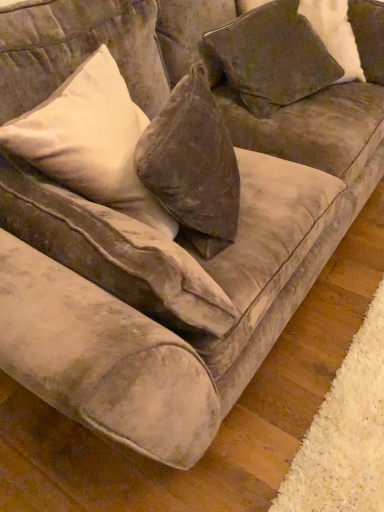
Image resolution: width=384 pixels, height=512 pixels. Find the location of `velvet beige pillow at upper left, acting as the first pillow starting from the left`. velvet beige pillow at upper left, acting as the first pillow starting from the left is located at coordinates (90, 141).

What do you see at coordinates (90, 141) in the screenshot?
I see `velvet beige pillow at upper left, acting as the second pillow starting from the right` at bounding box center [90, 141].

At what (x,y) coordinates should I click in order to perform the action: click on velvet brown pillow at upper right, arranged as the second pillow when viewed from the left. Please return your answer as a coordinate pair (x, y). The image size is (384, 512). Looking at the image, I should click on (269, 58).

Measure the distance between point (262, 48) and camera.

The distance of point (262, 48) from camera is 1.44 meters.

Describe the element at coordinates (269, 58) in the screenshot. I see `velvet brown pillow at upper right, placed as the 1th pillow when sorted from right to left` at that location.

The height and width of the screenshot is (512, 384). I want to click on velvet beige pillow at upper left, acting as the first pillow starting from the left, so click(x=90, y=141).

Can you confirm if velvet beige pillow at upper left, acting as the second pillow starting from the right, is positioned to the right of velvet brown pillow at upper right, arranged as the second pillow when viewed from the left?

No.

Is the position of velvet beige pillow at upper left, acting as the first pillow starting from the left, more distant than that of velvet brown pillow at upper right, placed as the 1th pillow when sorted from right to left?

No, the depth of velvet beige pillow at upper left, acting as the first pillow starting from the left, is less than that of velvet brown pillow at upper right, placed as the 1th pillow when sorted from right to left.

Is point (16, 120) farther from viewer compared to point (214, 62)?

No.

From the image's perspective, is velvet beige pillow at upper left, acting as the second pillow starting from the right, positioned above or below velvet brown pillow at upper right, arranged as the second pillow when viewed from the left?

Based on their image positions, velvet beige pillow at upper left, acting as the second pillow starting from the right, is located beneath velvet brown pillow at upper right, arranged as the second pillow when viewed from the left.

From a real-world perspective, who is located lower, velvet beige pillow at upper left, acting as the first pillow starting from the left, or velvet brown pillow at upper right, arranged as the second pillow when viewed from the left?

velvet brown pillow at upper right, arranged as the second pillow when viewed from the left.

Which object is wider, velvet beige pillow at upper left, acting as the second pillow starting from the right, or velvet brown pillow at upper right, arranged as the second pillow when viewed from the left?

velvet beige pillow at upper left, acting as the second pillow starting from the right, is wider.

Considering the sizes of objects velvet beige pillow at upper left, acting as the second pillow starting from the right, and velvet brown pillow at upper right, placed as the 1th pillow when sorted from right to left, in the image provided, who is taller, velvet beige pillow at upper left, acting as the second pillow starting from the right, or velvet brown pillow at upper right, placed as the 1th pillow when sorted from right to left,?

velvet beige pillow at upper left, acting as the second pillow starting from the right.

In the scene shown: Can you confirm if velvet beige pillow at upper left, acting as the first pillow starting from the left, is smaller than velvet brown pillow at upper right, placed as the 1th pillow when sorted from right to left?

Incorrect, velvet beige pillow at upper left, acting as the first pillow starting from the left, is not smaller in size than velvet brown pillow at upper right, placed as the 1th pillow when sorted from right to left.

Looking at this image, can we say velvet beige pillow at upper left, acting as the first pillow starting from the left, lies outside velvet brown pillow at upper right, placed as the 1th pillow when sorted from right to left?

Yes.

Is velvet beige pillow at upper left, acting as the second pillow starting from the right, far from velvet brown pillow at upper right, placed as the 1th pillow when sorted from right to left?

velvet beige pillow at upper left, acting as the second pillow starting from the right, is actually quite close to velvet brown pillow at upper right, placed as the 1th pillow when sorted from right to left.

Is velvet beige pillow at upper left, acting as the second pillow starting from the right, facing away from velvet brown pillow at upper right, arranged as the second pillow when viewed from the left?

No, velvet beige pillow at upper left, acting as the second pillow starting from the right, is not facing away from velvet brown pillow at upper right, arranged as the second pillow when viewed from the left.

At what (x,y) coordinates should I click in order to perform the action: click on pillow behind the velvet beige pillow at upper left, acting as the first pillow starting from the left. Please return your answer as a coordinate pair (x, y). Looking at the image, I should click on (269, 58).

Can you confirm if velvet brown pillow at upper right, placed as the 1th pillow when sorted from right to left, is positioned to the left of velvet beige pillow at upper left, acting as the first pillow starting from the left?

Incorrect, velvet brown pillow at upper right, placed as the 1th pillow when sorted from right to left, is not on the left side of velvet beige pillow at upper left, acting as the first pillow starting from the left.

Which object is further away from the camera taking this photo, velvet brown pillow at upper right, placed as the 1th pillow when sorted from right to left, or velvet beige pillow at upper left, acting as the first pillow starting from the left?

velvet brown pillow at upper right, placed as the 1th pillow when sorted from right to left, is further from the camera.

Considering the positions of points (295, 69) and (98, 140), is point (295, 69) closer to camera compared to point (98, 140)?

No.

From the image's perspective, which one is positioned lower, velvet brown pillow at upper right, arranged as the second pillow when viewed from the left, or velvet beige pillow at upper left, acting as the first pillow starting from the left?

From the image's view, velvet beige pillow at upper left, acting as the first pillow starting from the left, is below.

From a real-world perspective, is velvet brown pillow at upper right, arranged as the second pillow when viewed from the left, on top of velvet beige pillow at upper left, acting as the first pillow starting from the left?

Incorrect, from a real-world perspective, velvet brown pillow at upper right, arranged as the second pillow when viewed from the left, is lower than velvet beige pillow at upper left, acting as the first pillow starting from the left.

Considering the sizes of objects velvet brown pillow at upper right, arranged as the second pillow when viewed from the left, and velvet beige pillow at upper left, acting as the second pillow starting from the right, in the image provided, who is wider, velvet brown pillow at upper right, arranged as the second pillow when viewed from the left, or velvet beige pillow at upper left, acting as the second pillow starting from the right,?

velvet beige pillow at upper left, acting as the second pillow starting from the right, is wider.

Considering the relative sizes of velvet brown pillow at upper right, arranged as the second pillow when viewed from the left, and velvet beige pillow at upper left, acting as the second pillow starting from the right, in the image provided, is velvet brown pillow at upper right, arranged as the second pillow when viewed from the left, shorter than velvet beige pillow at upper left, acting as the second pillow starting from the right,?

Indeed, velvet brown pillow at upper right, arranged as the second pillow when viewed from the left, has a lesser height compared to velvet beige pillow at upper left, acting as the second pillow starting from the right.

Between velvet brown pillow at upper right, arranged as the second pillow when viewed from the left, and velvet beige pillow at upper left, acting as the first pillow starting from the left, which one has smaller size?

velvet brown pillow at upper right, arranged as the second pillow when viewed from the left.

Is velvet brown pillow at upper right, arranged as the second pillow when viewed from the left, located outside velvet beige pillow at upper left, acting as the first pillow starting from the left?

Yes.

From the picture: Is velvet brown pillow at upper right, placed as the 1th pillow when sorted from right to left, next to velvet beige pillow at upper left, acting as the second pillow starting from the right?

There is a gap between velvet brown pillow at upper right, placed as the 1th pillow when sorted from right to left, and velvet beige pillow at upper left, acting as the second pillow starting from the right.

Is velvet brown pillow at upper right, placed as the 1th pillow when sorted from right to left, oriented towards velvet beige pillow at upper left, acting as the first pillow starting from the left?

No, velvet brown pillow at upper right, placed as the 1th pillow when sorted from right to left, is not aimed at velvet beige pillow at upper left, acting as the first pillow starting from the left.

Can you tell me how much velvet brown pillow at upper right, placed as the 1th pillow when sorted from right to left, and velvet beige pillow at upper left, acting as the second pillow starting from the right, differ in facing direction?

velvet brown pillow at upper right, placed as the 1th pillow when sorted from right to left, and velvet beige pillow at upper left, acting as the second pillow starting from the right, are facing 54.2 degrees away from each other.

Identify the location of pillow on the left of velvet brown pillow at upper right, arranged as the second pillow when viewed from the left. The image size is (384, 512). (90, 141).

Locate an element on the screen. pillow lying above the velvet beige pillow at upper left, acting as the second pillow starting from the right (from the image's perspective) is located at coordinates (269, 58).

The height and width of the screenshot is (512, 384). In the image, there is a velvet beige pillow at upper left, acting as the first pillow starting from the left. Identify the location of pillow below it (from a real-world perspective). (269, 58).